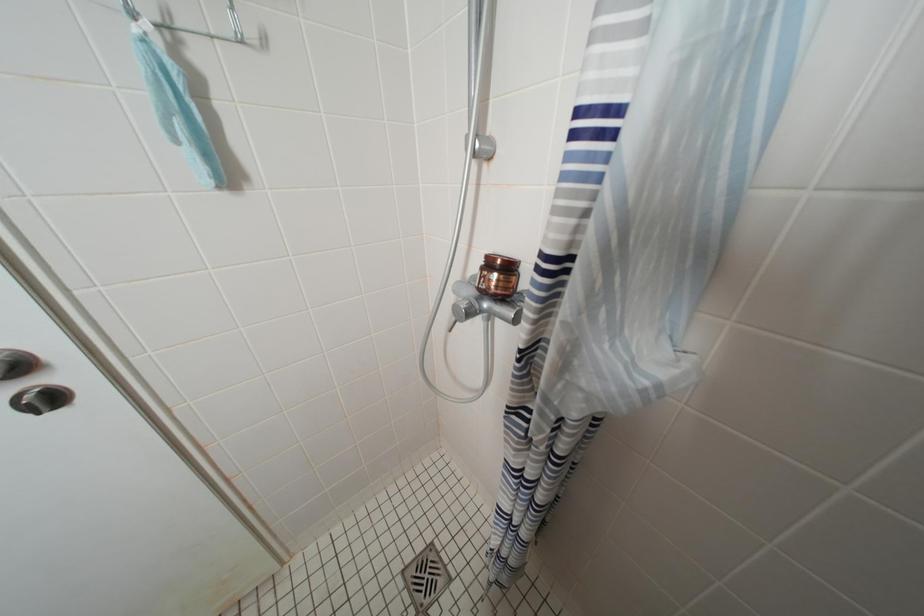
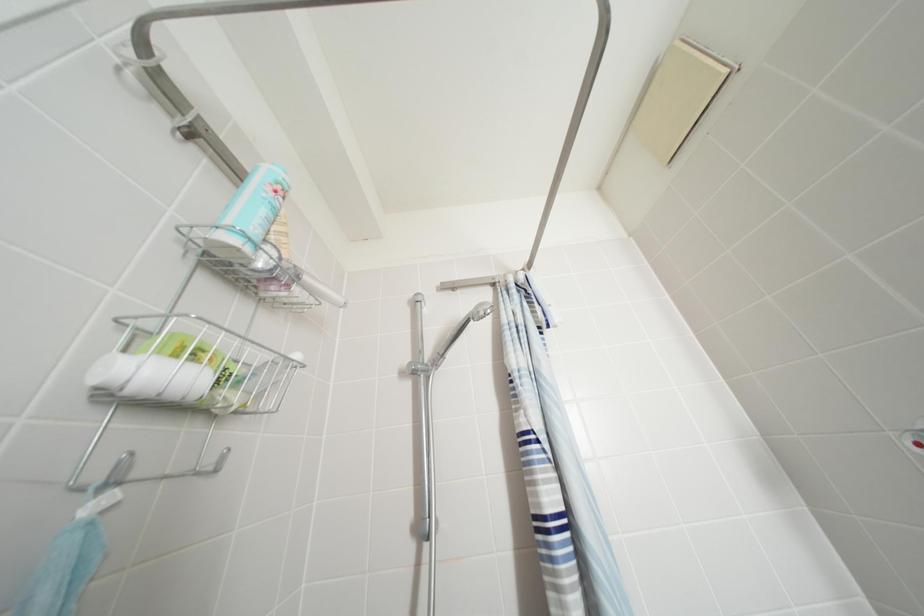
Based on the continuous images, in which direction is the camera rotating?

The rotation direction of the camera is right-up.